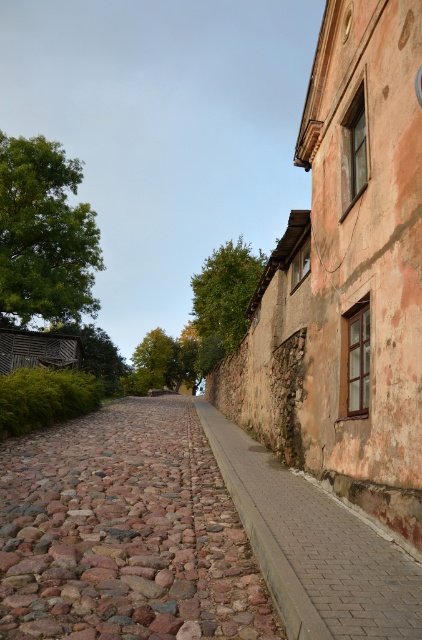
Question: Is brown rough cobblestone at center positioned before brick pavement at lower right?

Choices:
 (A) no
 (B) yes

Answer: (A)

Question: Can you confirm if brown rough cobblestone at center is wider than brick pavement at lower right?

Choices:
 (A) yes
 (B) no

Answer: (A)

Question: Is brown rough cobblestone at center wider than brick pavement at lower right?

Choices:
 (A) yes
 (B) no

Answer: (A)